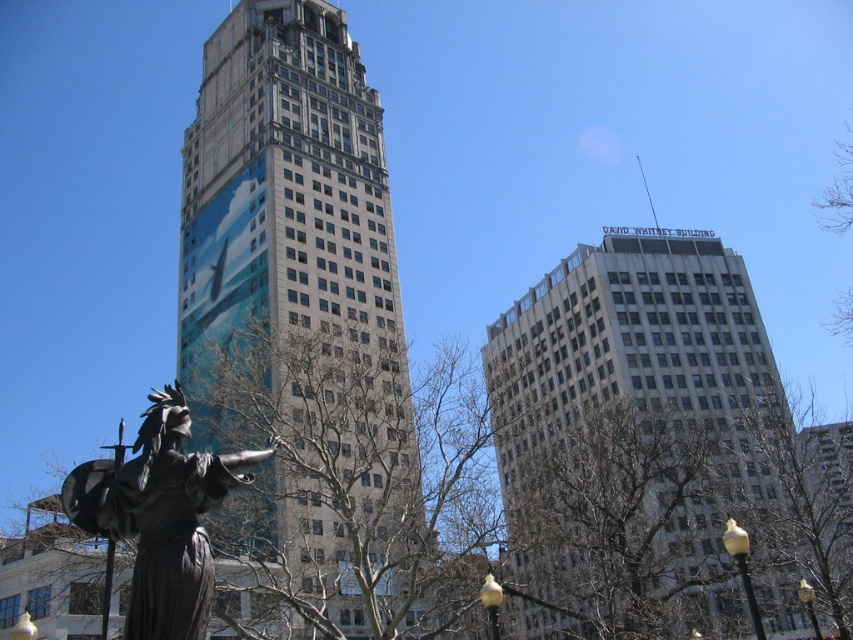
Question: Estimate the real-world distances between objects in this image. Which object is closer to the white glass building at upper right?

Choices:
 (A) bronze statue at lower left
 (B) metallic glass skyscraper at center

Answer: (B)

Question: Can you confirm if white glass building at upper right is smaller than bronze statue at lower left?

Choices:
 (A) no
 (B) yes

Answer: (A)

Question: Estimate the real-world distances between objects in this image. Which object is closer to the metallic glass skyscraper at center?

Choices:
 (A) white glass building at upper right
 (B) bronze statue at lower left

Answer: (B)

Question: Can you confirm if metallic glass skyscraper at center is bigger than bronze statue at lower left?

Choices:
 (A) yes
 (B) no

Answer: (A)

Question: Is metallic glass skyscraper at center positioned in front of white glass building at upper right?

Choices:
 (A) no
 (B) yes

Answer: (A)

Question: Based on their relative distances, which object is nearer to the metallic glass skyscraper at center?

Choices:
 (A) white glass building at upper right
 (B) bronze statue at lower left

Answer: (B)